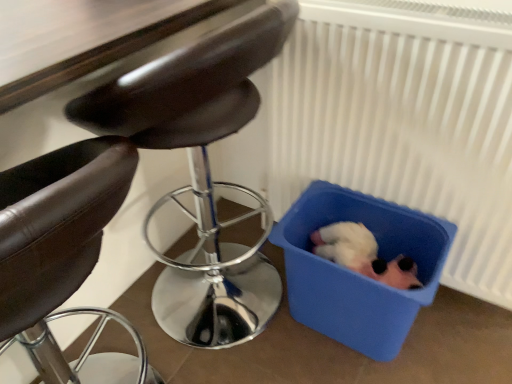
The width and height of the screenshot is (512, 384). What do you see at coordinates (63, 255) in the screenshot?
I see `leather-like black chair at left, acting as the 1th chair starting from the left` at bounding box center [63, 255].

Where is `leather-like black chair at left, acting as the 1th chair starting from the left`? Image resolution: width=512 pixels, height=384 pixels. leather-like black chair at left, acting as the 1th chair starting from the left is located at coordinates (63, 255).

The image size is (512, 384). Describe the element at coordinates (403, 122) in the screenshot. I see `white plastic radiator at lower right` at that location.

Locate an element on the screen. This screenshot has width=512, height=384. leather-like black chair at left, acting as the 1th chair starting from the left is located at coordinates (63, 255).

Between leather-like brown chair at center, which appears as the first chair when viewed from the right, and blue plastic bin at lower right, which one appears on the right side from the viewer's perspective?

blue plastic bin at lower right is more to the right.

From a real-world perspective, is leather-like brown chair at center, which appears as the first chair when viewed from the right, physically located above or below blue plastic bin at lower right?

From a real-world perspective, leather-like brown chair at center, which appears as the first chair when viewed from the right, is physically above blue plastic bin at lower right.

Is blue plastic bin at lower right inside leather-like brown chair at center, marked as the second chair in a left-to-right arrangement?

No, leather-like brown chair at center, marked as the second chair in a left-to-right arrangement, does not contain blue plastic bin at lower right.

From the image's perspective, is leather-like brown chair at center, which appears as the first chair when viewed from the right, above blue plastic bin at lower right?

Yes, from the image's perspective, leather-like brown chair at center, which appears as the first chair when viewed from the right, is over blue plastic bin at lower right.

Is leather-like brown chair at center, marked as the second chair in a left-to-right arrangement, to the left or to the right of white plastic radiator at lower right in the image?

leather-like brown chair at center, marked as the second chair in a left-to-right arrangement, is to the left of white plastic radiator at lower right.

Looking at this image, from a real-world perspective, is leather-like brown chair at center, marked as the second chair in a left-to-right arrangement, physically above white plastic radiator at lower right?

Yes.

Which of these two, leather-like brown chair at center, which appears as the first chair when viewed from the right, or white plastic radiator at lower right, is bigger?

leather-like brown chair at center, which appears as the first chair when viewed from the right, is bigger.

Can you confirm if white plastic radiator at lower right is smaller than blue plastic bin at lower right?

No.

Is white plastic radiator at lower right outside of blue plastic bin at lower right?

white plastic radiator at lower right is positioned outside blue plastic bin at lower right.

I want to click on storage box that is below the white plastic radiator at lower right (from the image's perspective), so click(356, 273).

Based on the photo, is blue plastic bin at lower right at the back of white plastic radiator at lower right?

Yes, white plastic radiator at lower right is facing away from blue plastic bin at lower right.

From the image's perspective, which object appears higher, blue plastic bin at lower right or leather-like brown chair at center, which appears as the first chair when viewed from the right?

leather-like brown chair at center, which appears as the first chair when viewed from the right, is shown above in the image.

Could you measure the distance between blue plastic bin at lower right and leather-like brown chair at center, which appears as the first chair when viewed from the right?

14.65 inches.

From a real-world perspective, is blue plastic bin at lower right located beneath leather-like brown chair at center, which appears as the first chair when viewed from the right?

Yes, from a real-world perspective, blue plastic bin at lower right is beneath leather-like brown chair at center, which appears as the first chair when viewed from the right.

Is blue plastic bin at lower right aimed at leather-like brown chair at center, marked as the second chair in a left-to-right arrangement?

No, blue plastic bin at lower right does not turn towards leather-like brown chair at center, marked as the second chair in a left-to-right arrangement.

From a real-world perspective, is white plastic radiator at lower right physically located above or below leather-like black chair at left, acting as the 1th chair starting from the left?

white plastic radiator at lower right is situated higher than leather-like black chair at left, acting as the 1th chair starting from the left, in the real world.

Looking at this image, from the image's perspective, is white plastic radiator at lower right on leather-like black chair at left, acting as the 1th chair starting from the left?

Correct, white plastic radiator at lower right appears higher than leather-like black chair at left, acting as the 1th chair starting from the left, in the image.

Visually, is white plastic radiator at lower right positioned to the left or to the right of leather-like black chair at left, which is counted as the 2th chair, starting from the right?

From the image, it's evident that white plastic radiator at lower right is to the right of leather-like black chair at left, which is counted as the 2th chair, starting from the right.

How much distance is there between leather-like black chair at left, which is counted as the 2th chair, starting from the right, and leather-like brown chair at center, marked as the second chair in a left-to-right arrangement?

leather-like black chair at left, which is counted as the 2th chair, starting from the right, and leather-like brown chair at center, marked as the second chair in a left-to-right arrangement, are 32.99 inches apart.

Between leather-like black chair at left, which is counted as the 2th chair, starting from the right, and leather-like brown chair at center, which appears as the first chair when viewed from the right, which one has smaller size?

leather-like black chair at left, which is counted as the 2th chair, starting from the right, is smaller.

Would you say leather-like brown chair at center, marked as the second chair in a left-to-right arrangement, is part of leather-like black chair at left, acting as the 1th chair starting from the left,'s contents?

Actually, leather-like brown chair at center, marked as the second chair in a left-to-right arrangement, is outside leather-like black chair at left, acting as the 1th chair starting from the left.

Considering the sizes of objects leather-like black chair at left, which is counted as the 2th chair, starting from the right, and leather-like brown chair at center, which appears as the first chair when viewed from the right, in the image provided, who is thinner, leather-like black chair at left, which is counted as the 2th chair, starting from the right, or leather-like brown chair at center, which appears as the first chair when viewed from the right,?

leather-like black chair at left, which is counted as the 2th chair, starting from the right, is thinner.

Is blue plastic bin at lower right placed right next to white plastic radiator at lower right?

No, blue plastic bin at lower right is not in contact with white plastic radiator at lower right.

Is blue plastic bin at lower right turned away from white plastic radiator at lower right?

Correct, blue plastic bin at lower right is looking away from white plastic radiator at lower right.

Measure the distance between blue plastic bin at lower right and white plastic radiator at lower right.

blue plastic bin at lower right and white plastic radiator at lower right are 9.27 inches apart from each other.

Can you confirm if blue plastic bin at lower right is bigger than white plastic radiator at lower right?

No, blue plastic bin at lower right is not bigger than white plastic radiator at lower right.

Identify the location of storage box behind the leather-like brown chair at center, which appears as the first chair when viewed from the right. The image size is (512, 384). [x=356, y=273].

At what (x,y) coordinates should I click in order to perform the action: click on chair that is the 1st one when counting leftward from the white plastic radiator at lower right. Please return your answer as a coordinate pair (x, y). The image size is (512, 384). Looking at the image, I should click on (201, 170).

Looking at the image, which one is located closer to leather-like black chair at left, acting as the 1th chair starting from the left, blue plastic bin at lower right or white plastic radiator at lower right?

blue plastic bin at lower right is closer to leather-like black chair at left, acting as the 1th chair starting from the left.

Based on their spatial positions, is blue plastic bin at lower right or white plastic radiator at lower right closer to leather-like brown chair at center, which appears as the first chair when viewed from the right?

Based on the image, blue plastic bin at lower right appears to be nearer to leather-like brown chair at center, which appears as the first chair when viewed from the right.

When comparing their distances from white plastic radiator at lower right, does blue plastic bin at lower right or leather-like brown chair at center, which appears as the first chair when viewed from the right, seem further?

leather-like brown chair at center, which appears as the first chair when viewed from the right, lies further to white plastic radiator at lower right than the other object.

Estimate the real-world distances between objects in this image. Which object is further from white plastic radiator at lower right, leather-like black chair at left, which is counted as the 2th chair, starting from the right, or leather-like brown chair at center, which appears as the first chair when viewed from the right?

leather-like black chair at left, which is counted as the 2th chair, starting from the right, is positioned further to the anchor white plastic radiator at lower right.

Which object lies further to the anchor point white plastic radiator at lower right, leather-like brown chair at center, marked as the second chair in a left-to-right arrangement, or blue plastic bin at lower right?

leather-like brown chair at center, marked as the second chair in a left-to-right arrangement, is further to white plastic radiator at lower right.

Looking at this image, from the image, which object appears to be nearer to leather-like brown chair at center, marked as the second chair in a left-to-right arrangement, leather-like black chair at left, acting as the 1th chair starting from the left, or white plastic radiator at lower right?

The object closer to leather-like brown chair at center, marked as the second chair in a left-to-right arrangement, is white plastic radiator at lower right.

From the image, which object appears to be farther from blue plastic bin at lower right, leather-like black chair at left, acting as the 1th chair starting from the left, or white plastic radiator at lower right?

leather-like black chair at left, acting as the 1th chair starting from the left.

Which object lies further to the anchor point leather-like brown chair at center, marked as the second chair in a left-to-right arrangement, leather-like black chair at left, which is counted as the 2th chair, starting from the right, or blue plastic bin at lower right?

leather-like black chair at left, which is counted as the 2th chair, starting from the right, is positioned further to the anchor leather-like brown chair at center, marked as the second chair in a left-to-right arrangement.

Identify the location of chair situated between leather-like black chair at left, acting as the 1th chair starting from the left, and white plastic radiator at lower right from left to right. The image size is (512, 384). (201, 170).

Where is `chair situated between leather-like black chair at left, which is counted as the 2th chair, starting from the right, and blue plastic bin at lower right from left to right`? chair situated between leather-like black chair at left, which is counted as the 2th chair, starting from the right, and blue plastic bin at lower right from left to right is located at coordinates tap(201, 170).

Identify the location of storage box situated between leather-like brown chair at center, marked as the second chair in a left-to-right arrangement, and white plastic radiator at lower right from left to right. The height and width of the screenshot is (384, 512). (356, 273).

At what (x,y) coordinates should I click in order to perform the action: click on storage box between leather-like black chair at left, acting as the 1th chair starting from the left, and white plastic radiator at lower right from left to right. Please return your answer as a coordinate pair (x, y). The image size is (512, 384). Looking at the image, I should click on (356, 273).